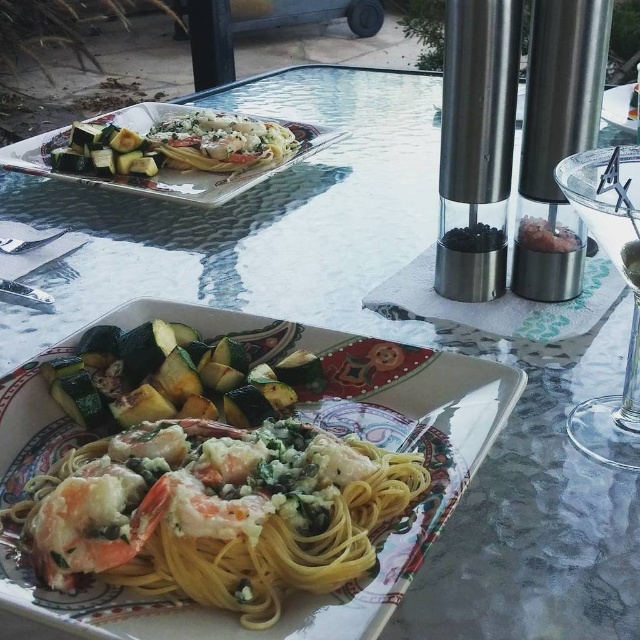
Measure the distance between point (36,376) and camera.

Point (36,376) and camera are 12.80 inches apart from each other.

Does yellow matte pasta at center appear over green matte zucchini at left?

Actually, yellow matte pasta at center is below green matte zucchini at left.

Is point (305, 336) behind point (104, 131)?

No.

At what (x,y) coordinates should I click in order to perform the action: click on yellow matte pasta at center. Please return your answer as a coordinate pair (x, y). Image resolution: width=640 pixels, height=640 pixels. Looking at the image, I should click on (337, 433).

Does point (612, 420) come in front of point (84, 156)?

Yes, it is in front of point (84, 156).

Who is more distant from viewer, (609, 172) or (76, 147)?

Positioned behind is point (76, 147).

Between point (580, 156) and point (129, 154), which one is positioned behind?

Positioned behind is point (129, 154).

The image size is (640, 640). Find the location of `transparent glass at right`. transparent glass at right is located at coordinates (625, 280).

Can you confirm if green matte zucchini at lower left is bigger than white creamy pasta at upper center?

No.

Between point (112, 394) and point (262, 141), which one is positioned behind?

Point (262, 141)

Does point (225, 355) come in front of point (154, 141)?

Yes, point (225, 355) is closer to viewer.

This screenshot has width=640, height=640. Find the location of `green matte zucchini at lower left`. green matte zucchini at lower left is located at coordinates (172, 378).